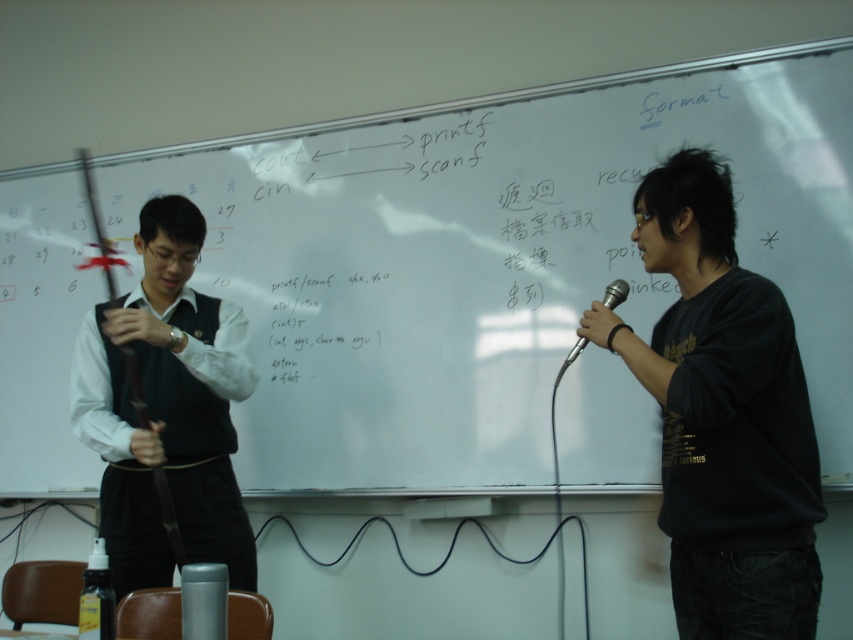
Between point (776, 408) and point (622, 280), which one is positioned behind?

The point (622, 280) is more distant.

Is black matte shirt at right to the right of silver metallic microphone at right from the viewer's perspective?

Yes, black matte shirt at right is to the right of silver metallic microphone at right.

Is point (720, 310) in front of point (613, 282)?

That is True.

Identify the location of black matte shirt at right. (723, 416).

Does whiteboard at center have a greater width compared to silver metallic microphone at right?

Yes.

Which is above, whiteboard at center or silver metallic microphone at right?

Positioned higher is whiteboard at center.

Does point (397, 138) lie in front of point (583, 342)?

No.

At what (x,y) coordinates should I click in order to perform the action: click on whiteboard at center. Please return your answer as a coordinate pair (x, y). The height and width of the screenshot is (640, 853). Looking at the image, I should click on (495, 259).

Is whiteboard at center further to camera compared to black matte shirt at right?

Yes, whiteboard at center is behind black matte shirt at right.

Who is lower down, whiteboard at center or black matte shirt at right?

black matte shirt at right

Does point (489, 284) come behind point (663, 173)?

Yes.

Where is `whiteboard at center`? Image resolution: width=853 pixels, height=640 pixels. whiteboard at center is located at coordinates (495, 259).